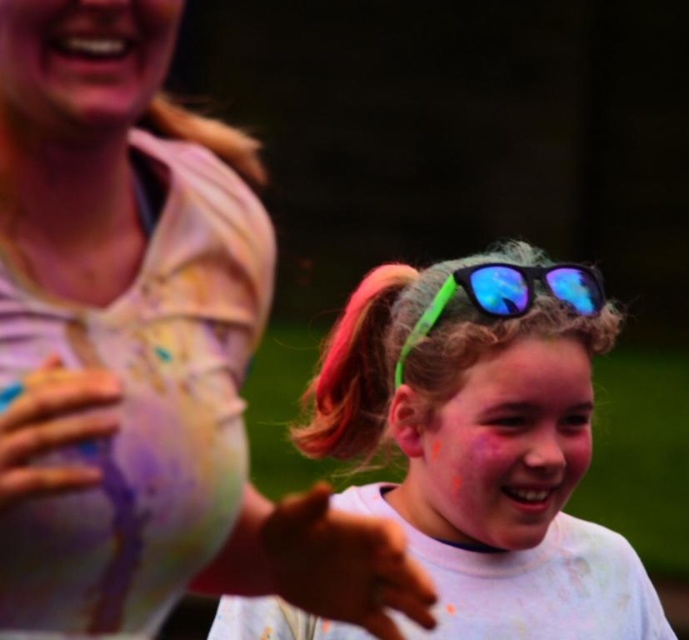
Question: Estimate the real-world distances between objects in this image. Which object is closer to the neon green plastic sunglasses at center?

Choices:
 (A) pink fabric hand at center
 (B) matte white face at center

Answer: (B)

Question: From the image, what is the correct spatial relationship of matte skin at upper left in relation to smooth white glove at left?

Choices:
 (A) above
 (B) below

Answer: (A)

Question: Can you confirm if matte skin at upper left is positioned below smooth white glove at left?

Choices:
 (A) yes
 (B) no

Answer: (B)

Question: Estimate the real-world distances between objects in this image. Which object is farther from the blue reflective plastic goggles at center?

Choices:
 (A) smooth white glove at left
 (B) neon green plastic sunglasses at center
 (C) matte skin at upper left
 (D) matte white face at center

Answer: (A)

Question: Which point is farther to the camera?

Choices:
 (A) neon green plastic sunglasses at center
 (B) matte skin at upper left
 (C) blue reflective plastic goggles at center
 (D) matte white face at center

Answer: (D)

Question: Does matte skin at upper left come behind pink fabric hand at center?

Choices:
 (A) yes
 (B) no

Answer: (B)